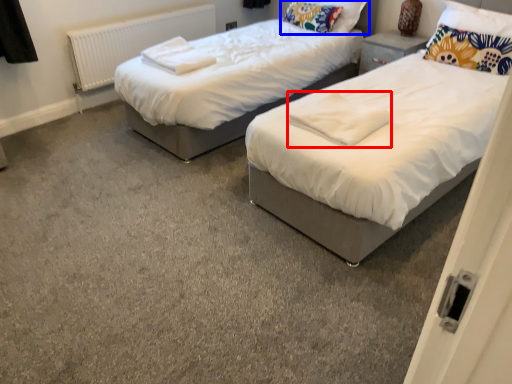
Question: Which object appears closest to the camera in this image, linen (highlighted by a red box) or pillow (highlighted by a blue box)?

Choices:
 (A) linen
 (B) pillow

Answer: (A)